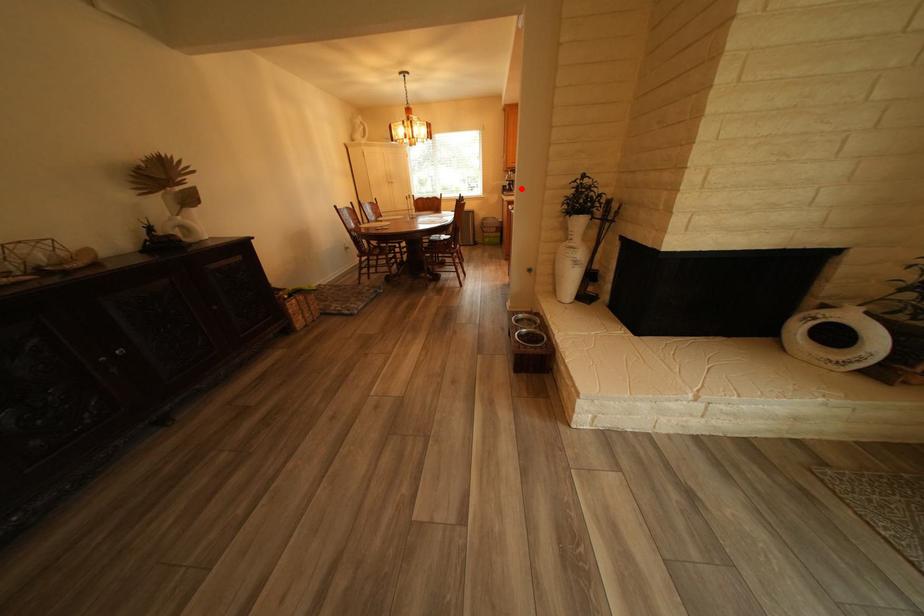
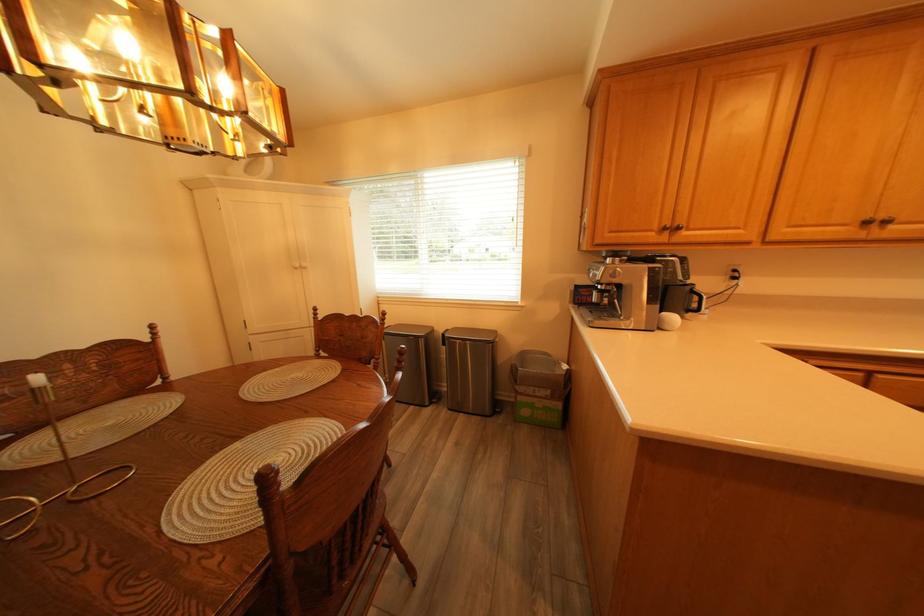
Question: I am providing you with two images of the same scene from different viewpoints. A red point is marked on the first image. Can you still see the location of the red point in image 2?

Choices:
 (A) Yes
 (B) No

Answer: (A)